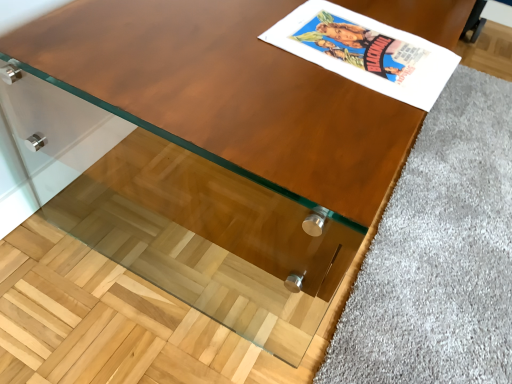
Describe the element at coordinates (366, 52) in the screenshot. I see `matte paper comic book at upper right` at that location.

The image size is (512, 384). I want to click on matte paper comic book at upper right, so click(x=366, y=52).

You are a GUI agent. You are given a task and a screenshot of the screen. Output one action in this format:
    pyautogui.click(x=<x>, y=<y>)
    Task: Click on the soft gray carpet at lower right
    This screenshot has height=384, width=512.
    Given the screenshot: What is the action you would take?
    pyautogui.click(x=439, y=254)

Image resolution: width=512 pixels, height=384 pixels. Describe the element at coordinates (439, 254) in the screenshot. I see `soft gray carpet at lower right` at that location.

Where is `matte paper comic book at upper right`? The image size is (512, 384). matte paper comic book at upper right is located at coordinates (366, 52).

Between soft gray carpet at lower right and matte paper comic book at upper right, which one appears on the left side from the viewer's perspective?

From the viewer's perspective, matte paper comic book at upper right appears more on the left side.

Looking at this image, is soft gray carpet at lower right further to the viewer compared to matte paper comic book at upper right?

Yes, soft gray carpet at lower right is behind matte paper comic book at upper right.

Is point (373, 342) closer to viewer compared to point (355, 57)?

No, (373, 342) is behind (355, 57).

From the image's perspective, would you say soft gray carpet at lower right is shown under matte paper comic book at upper right?

Yes, from the image's perspective, soft gray carpet at lower right is beneath matte paper comic book at upper right.

From a real-world perspective, is soft gray carpet at lower right over matte paper comic book at upper right?

Incorrect, from a real-world perspective, soft gray carpet at lower right is lower than matte paper comic book at upper right.

Considering the sizes of soft gray carpet at lower right and matte paper comic book at upper right in the image, is soft gray carpet at lower right wider or thinner than matte paper comic book at upper right?

soft gray carpet at lower right is wider than matte paper comic book at upper right.

Is soft gray carpet at lower right shorter than matte paper comic book at upper right?

Indeed, soft gray carpet at lower right has a lesser height compared to matte paper comic book at upper right.

Considering the relative sizes of soft gray carpet at lower right and matte paper comic book at upper right in the image provided, is soft gray carpet at lower right smaller than matte paper comic book at upper right?

Actually, soft gray carpet at lower right might be larger than matte paper comic book at upper right.

Is soft gray carpet at lower right inside the boundaries of matte paper comic book at upper right, or outside?

soft gray carpet at lower right is not inside matte paper comic book at upper right, it's outside.

Is the surface of soft gray carpet at lower right in direct contact with matte paper comic book at upper right?

No, soft gray carpet at lower right is not beside matte paper comic book at upper right.

Is soft gray carpet at lower right facing away from matte paper comic book at upper right?

soft gray carpet at lower right does not have its back to matte paper comic book at upper right.

At what (x,y) coordinates should I click in order to perform the action: click on gray on the right of matte paper comic book at upper right. Please return your answer as a coordinate pair (x, y). Looking at the image, I should click on (439, 254).

Based on their positions, is matte paper comic book at upper right located to the left or right of soft gray carpet at lower right?

Based on their positions, matte paper comic book at upper right is located to the left of soft gray carpet at lower right.

Is matte paper comic book at upper right further to camera compared to soft gray carpet at lower right?

No, matte paper comic book at upper right is closer to the viewer.

Considering the points (332, 13) and (351, 334), which point is behind, point (332, 13) or point (351, 334)?

The point (351, 334) is more distant.

From the image's perspective, between matte paper comic book at upper right and soft gray carpet at lower right, which one is located above?

matte paper comic book at upper right is shown above in the image.

Consider the image. From a real-world perspective, who is located lower, matte paper comic book at upper right or soft gray carpet at lower right?

soft gray carpet at lower right is physically lower.

Between matte paper comic book at upper right and soft gray carpet at lower right, which one has larger width?

soft gray carpet at lower right.

Considering the sizes of matte paper comic book at upper right and soft gray carpet at lower right in the image, is matte paper comic book at upper right taller or shorter than soft gray carpet at lower right?

matte paper comic book at upper right is taller than soft gray carpet at lower right.

Which of these two, matte paper comic book at upper right or soft gray carpet at lower right, is bigger?

soft gray carpet at lower right.

Can we say matte paper comic book at upper right lies outside soft gray carpet at lower right?

That's correct, matte paper comic book at upper right is outside of soft gray carpet at lower right.

Is matte paper comic book at upper right with soft gray carpet at lower right?

No, matte paper comic book at upper right is not touching soft gray carpet at lower right.

Based on the photo, is soft gray carpet at lower right at the back of matte paper comic book at upper right?

matte paper comic book at upper right is not turned away from soft gray carpet at lower right.

What's the angular difference between matte paper comic book at upper right and soft gray carpet at lower right's facing directions?

There is a 85.9-degree angle between the facing directions of matte paper comic book at upper right and soft gray carpet at lower right.

Find the location of a particular element. This screenshot has height=384, width=512. gray on the right of matte paper comic book at upper right is located at coordinates (439, 254).

Where is `gray below the matte paper comic book at upper right (from a real-world perspective)`? This screenshot has width=512, height=384. gray below the matte paper comic book at upper right (from a real-world perspective) is located at coordinates (439, 254).

You are a GUI agent. You are given a task and a screenshot of the screen. Output one action in this format:
    pyautogui.click(x=<x>, y=<y>)
    Task: Click on the gray that appears on the right of matte paper comic book at upper right
    The image size is (512, 384).
    Given the screenshot: What is the action you would take?
    pyautogui.click(x=439, y=254)